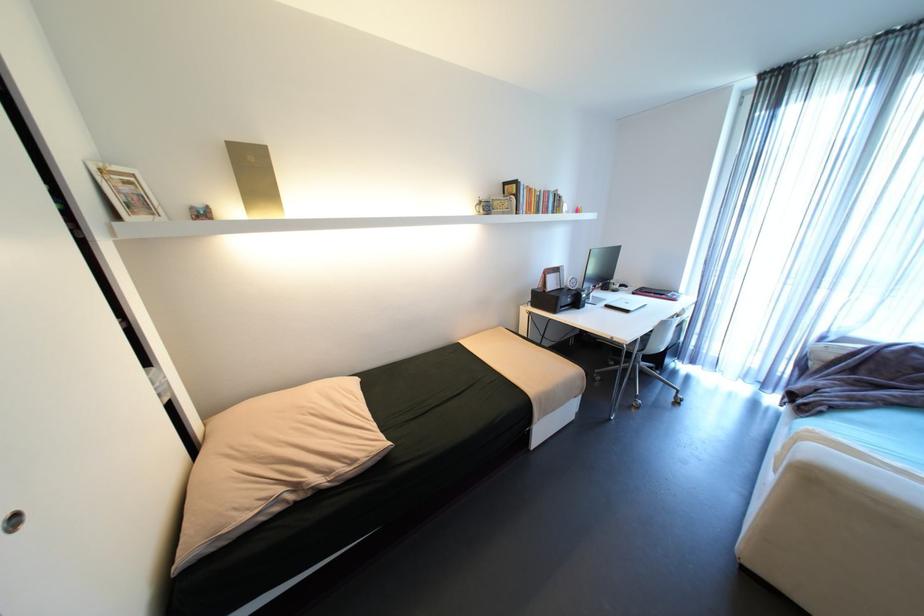
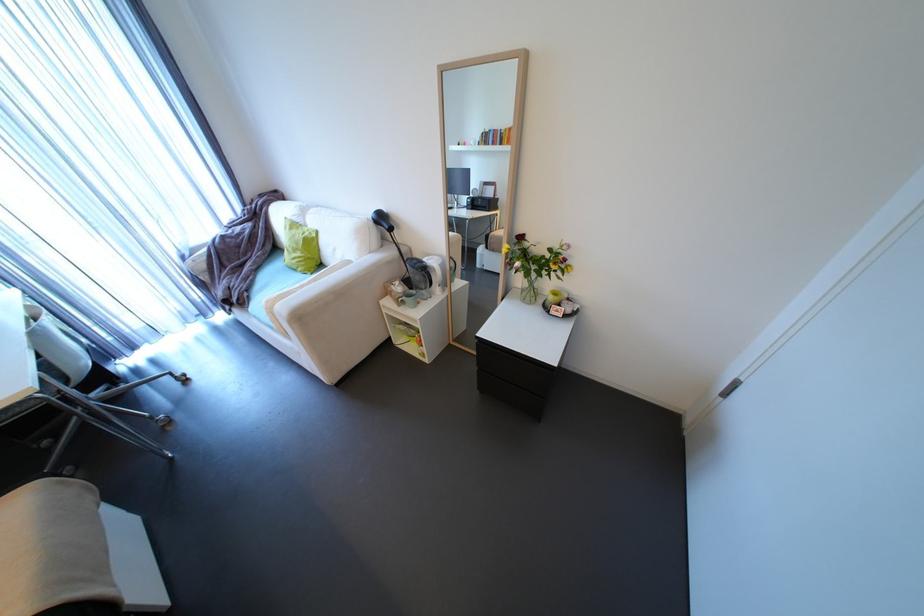
The point at (810, 408) is marked in the first image. Where is the corresponding point in the second image?

(248, 302)